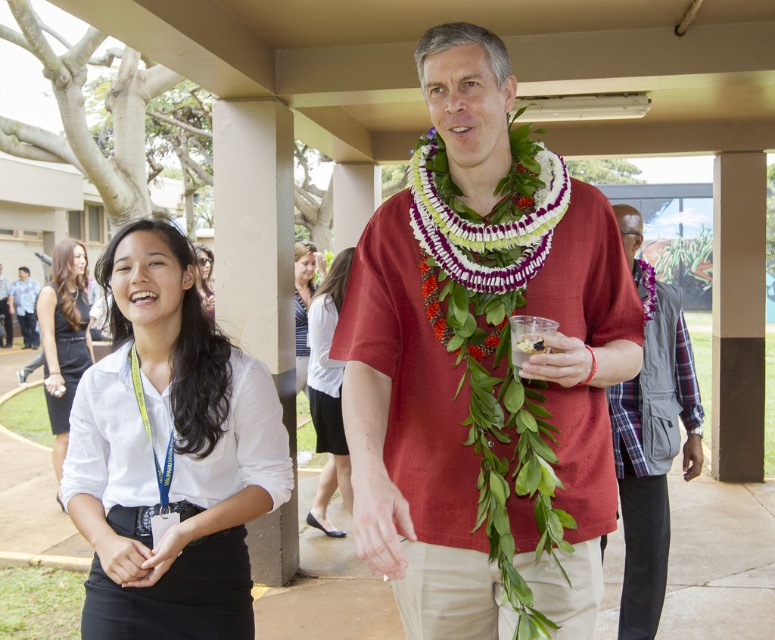
Question: Based on their relative distances, which object is nearer to the white cotton blouse at center?

Choices:
 (A) matte red shirt at center
 (B) striped fabric shirt at center
 (C) matte white shirt at center

Answer: (B)

Question: Does striped fabric shirt at center have a larger size compared to matte white shirt at center?

Choices:
 (A) no
 (B) yes

Answer: (A)

Question: Is matte red shirt at center smaller than white fabric shirt at center?

Choices:
 (A) yes
 (B) no

Answer: (B)

Question: Where is black dress at left located in relation to matte white shirt at center in the image?

Choices:
 (A) left
 (B) right

Answer: (B)

Question: Which point is closer to the camera?

Choices:
 (A) (2, 339)
 (B) (333, 486)
 (C) (195, 250)

Answer: (C)

Question: Which point is farther to the camera?

Choices:
 (A) (9, 282)
 (B) (33, 305)
 (C) (209, 320)
 (D) (486, 524)

Answer: (A)